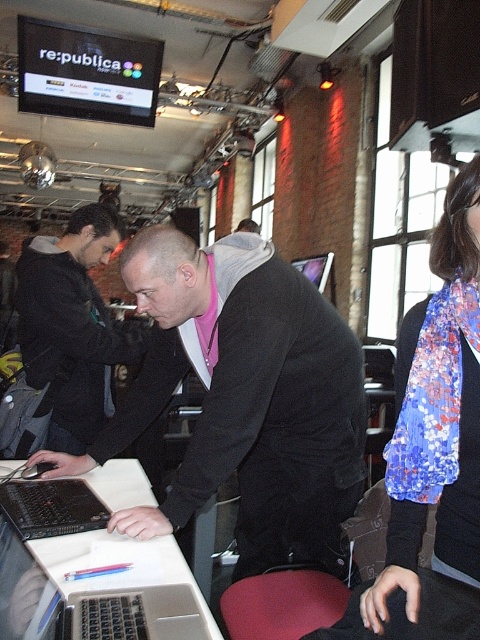
Is white plastic table at center wider than black matte keyboard at center?

Correct, the width of white plastic table at center exceeds that of black matte keyboard at center.

Which is more to the right, white plastic table at center or black matte keyboard at center?

From the viewer's perspective, white plastic table at center appears more on the right side.

Between point (133, 600) and point (10, 504), which one is positioned in front?

Point (133, 600)

I want to click on white plastic table at center, so click(100, 586).

Is the position of matte black jacket at center less distant than that of floral silk scarf at upper right?

No, matte black jacket at center is behind floral silk scarf at upper right.

Does point (187, 518) come behind point (474, 538)?

Yes.

Which is in front, point (346, 403) or point (462, 429)?

Positioned in front is point (462, 429).

Where is `matte black jacket at center`? The height and width of the screenshot is (640, 480). matte black jacket at center is located at coordinates (243, 397).

Is white plastic table at center to the right of dark gray hoodie at center from the viewer's perspective?

Indeed, white plastic table at center is positioned on the right side of dark gray hoodie at center.

Which is more to the left, white plastic table at center or dark gray hoodie at center?

From the viewer's perspective, dark gray hoodie at center appears more on the left side.

What do you see at coordinates (100, 586) in the screenshot?
I see `white plastic table at center` at bounding box center [100, 586].

Image resolution: width=480 pixels, height=640 pixels. Find the location of `white plastic table at center`. white plastic table at center is located at coordinates (100, 586).